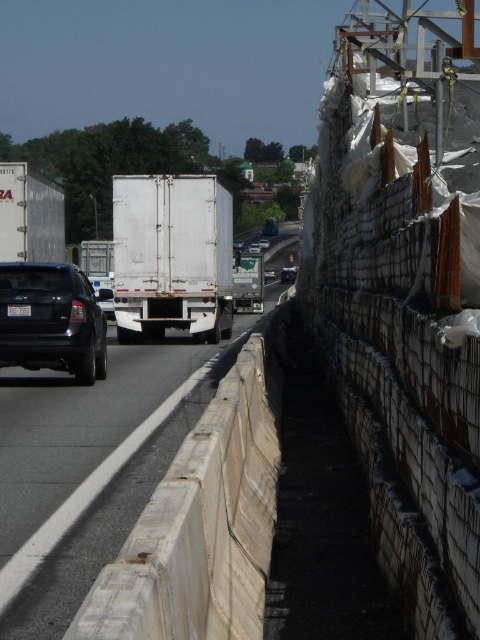
Can you confirm if shiny black sedan at center is shorter than white glossy truck at center?

Incorrect, shiny black sedan at center's height does not fall short of white glossy truck at center's.

Who is lower down, shiny black sedan at center or white glossy truck at center?

shiny black sedan at center is below.

I want to click on shiny black sedan at center, so click(x=288, y=273).

In order to click on shiny black sedan at center in this screenshot , I will do `click(288, 273)`.

Does white matte trailer truck at center have a greater height compared to shiny black sedan at center?

Yes, white matte trailer truck at center is taller than shiny black sedan at center.

Which is more to the right, white matte trailer truck at center or shiny black sedan at center?

From the viewer's perspective, shiny black sedan at center appears more on the right side.

This screenshot has height=640, width=480. What are the coordinates of `white matte trailer truck at center` in the screenshot? It's located at (171, 256).

Which is below, white matte trailer truck at center or white glossy truck at center?

white matte trailer truck at center is below.

Does white matte trailer truck at center appear on the left side of white glossy truck at center?

Correct, you'll find white matte trailer truck at center to the left of white glossy truck at center.

Where is `white matte trailer truck at center`? This screenshot has width=480, height=640. white matte trailer truck at center is located at coordinates (171, 256).